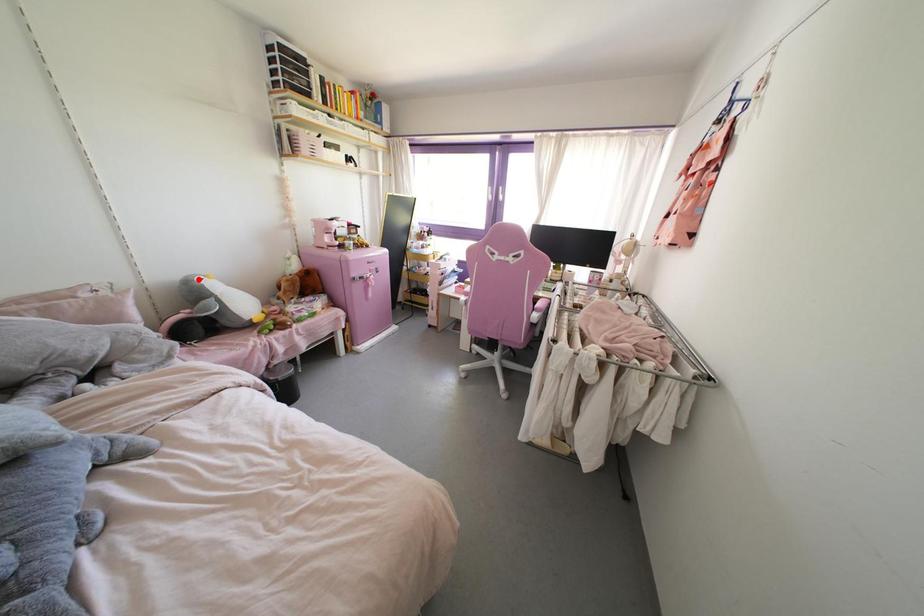
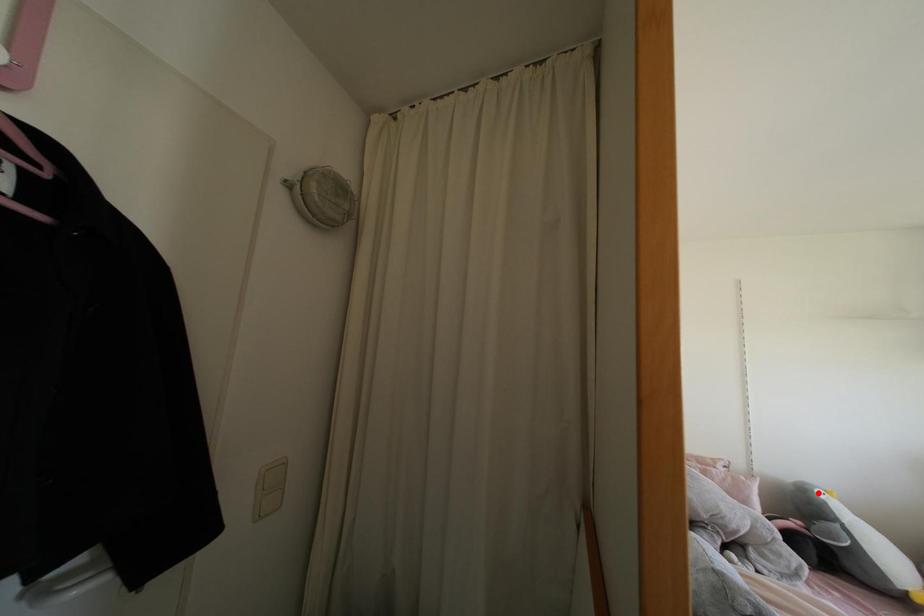
I am providing you with two images of the same scene from different viewpoints. A red point is marked on the first image and another point is marked on the second image. Does the point marked in image1 correspond to the same location as the one in image2?

Yes